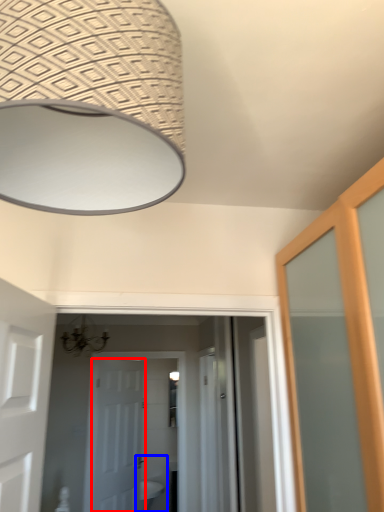
Question: Which object is further to the camera taking this photo, door (highlighted by a red box) or sink (highlighted by a blue box)?

Choices:
 (A) door
 (B) sink

Answer: (B)